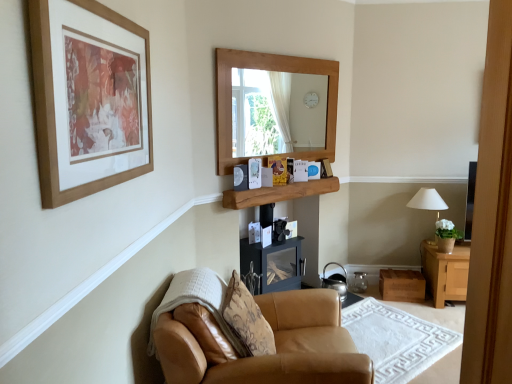
At what (x,y) coordinates should I click in order to perform the action: click on empty space that is ontop of wooden shelf at center. Please return your answer as a coordinate pair (x, y). Looking at the image, I should click on (286, 182).